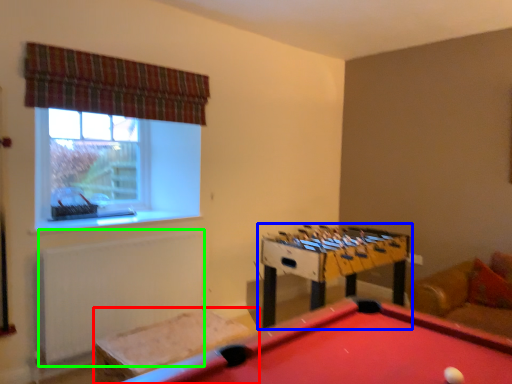
Question: Considering the real-world distances, which object is farthest from furniture (highlighted by a red box)? table (highlighted by a blue box) or radiator (highlighted by a green box)?

Choices:
 (A) table
 (B) radiator

Answer: (A)